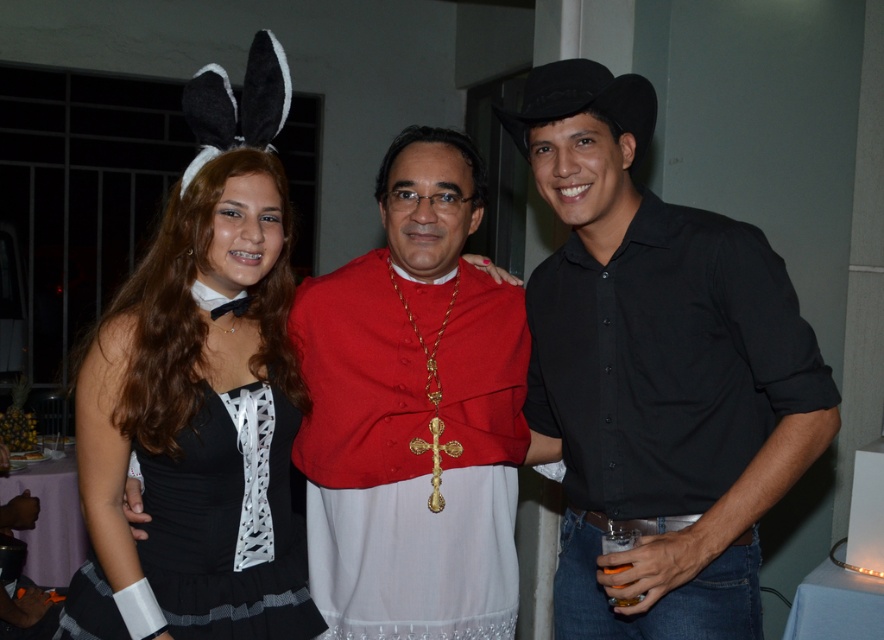
Does black cotton shirt at center appear under red velvet cape at center?

No, black cotton shirt at center is not below red velvet cape at center.

Is black cotton shirt at center bigger than red velvet cape at center?

Correct, black cotton shirt at center is larger in size than red velvet cape at center.

Where is `black cotton shirt at center`? Image resolution: width=884 pixels, height=640 pixels. black cotton shirt at center is located at coordinates (657, 372).

In order to click on black cotton shirt at center in this screenshot , I will do `click(657, 372)`.

Between point (680, 275) and point (180, 580), which one is positioned in front?

Positioned in front is point (180, 580).

Locate an element on the screen. This screenshot has width=884, height=640. black cotton shirt at center is located at coordinates (657, 372).

Which is below, red velvet cape at center or black satin dress at center?

Positioned lower is black satin dress at center.

This screenshot has height=640, width=884. Find the location of `red velvet cape at center`. red velvet cape at center is located at coordinates (410, 449).